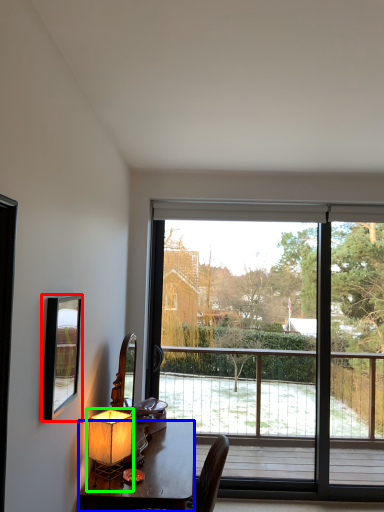
Question: Which object is positioned closest to mirror (highlighted by a red box)? Select from desk (highlighted by a blue box) and table lamp (highlighted by a green box).

Choices:
 (A) desk
 (B) table lamp

Answer: (B)